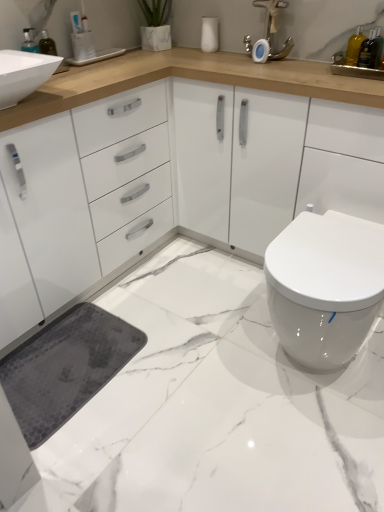
What are the coordinates of `free space in front of white glossy toilet at lower right` in the screenshot? It's located at (310, 446).